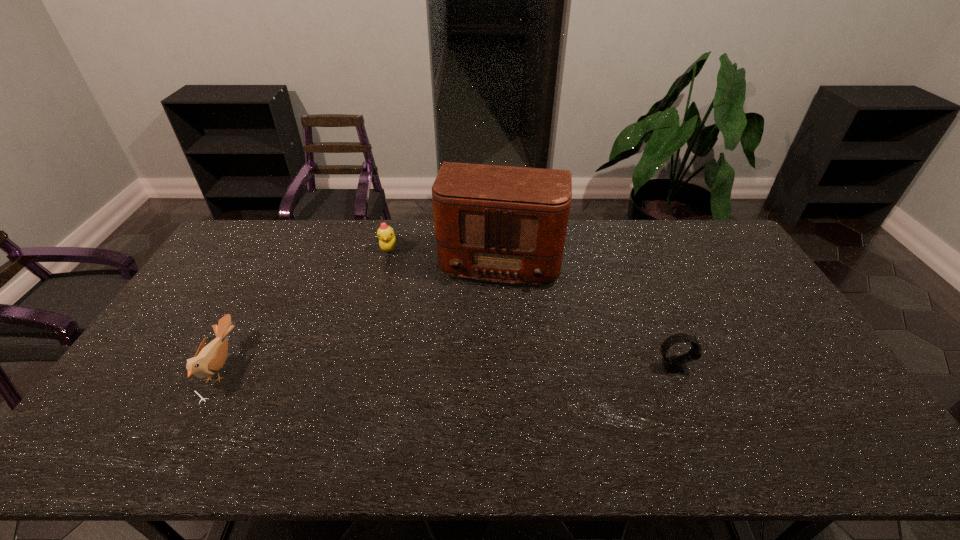
The height and width of the screenshot is (540, 960). In order to click on the third closest object to the third object from left to right in this screenshot , I will do `click(208, 360)`.

You are a GUI agent. You are given a task and a screenshot of the screen. Output one action in this format:
    pyautogui.click(x=<x>, y=<y>)
    Task: Click on the second closest object relative to the third object from left to right
    The height and width of the screenshot is (540, 960).
    Given the screenshot: What is the action you would take?
    pyautogui.click(x=672, y=364)

Identify the location of free space that satisfies the following two spatial constraints: 1. on the front side of the duckling; 2. on the face of the rightmost object. The width and height of the screenshot is (960, 540). (359, 366).